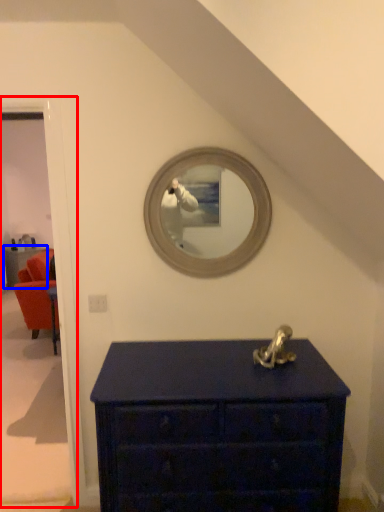
Question: Which of the following is the farthest to the observer, door (highlighted by a red box) or furniture (highlighted by a blue box)?

Choices:
 (A) door
 (B) furniture

Answer: (B)